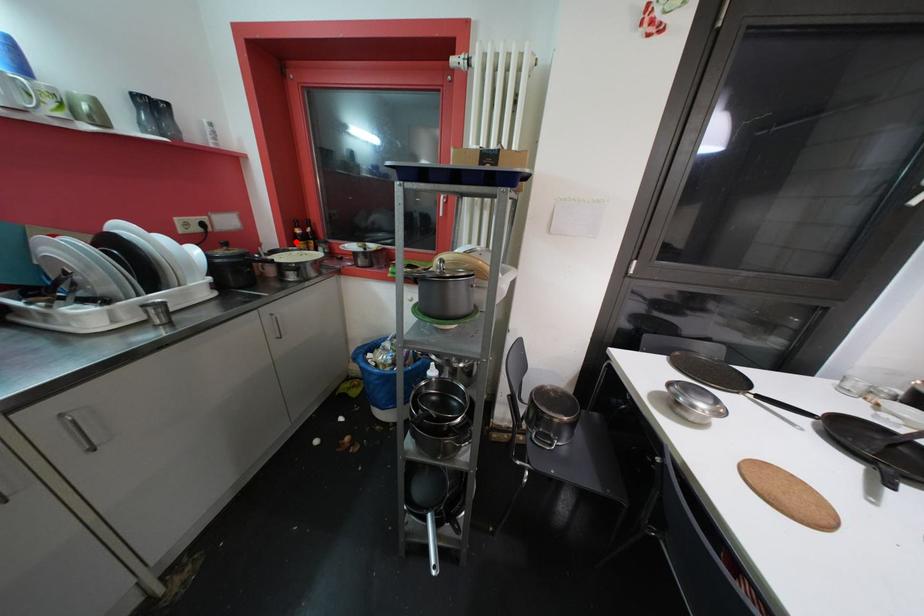
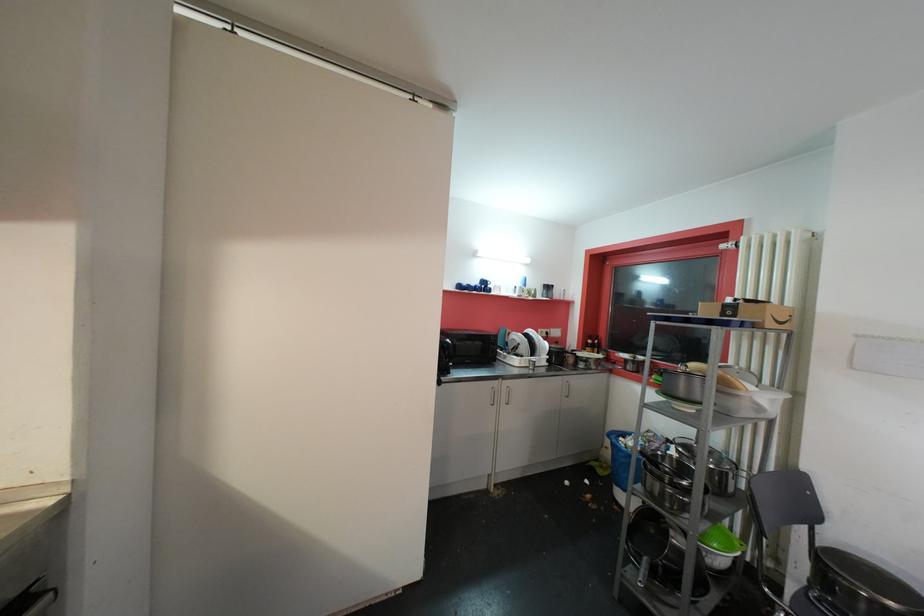
The point at the highlighted location is marked in the first image. Where is the corresponding point in the second image?

(590, 347)